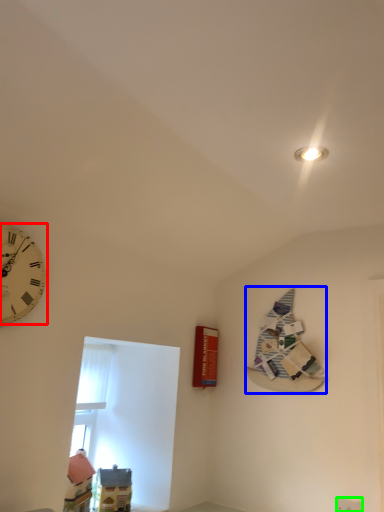
Question: Which object is the farthest from wall clock (highlighted by a red box)? Choose among these: book (highlighted by a blue box) or electric outlet (highlighted by a green box).

Choices:
 (A) book
 (B) electric outlet

Answer: (B)